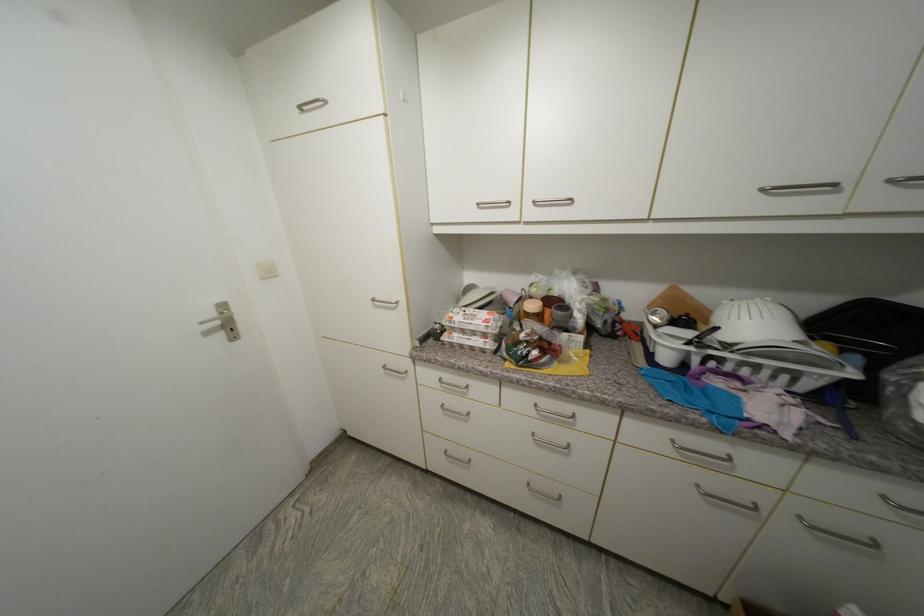
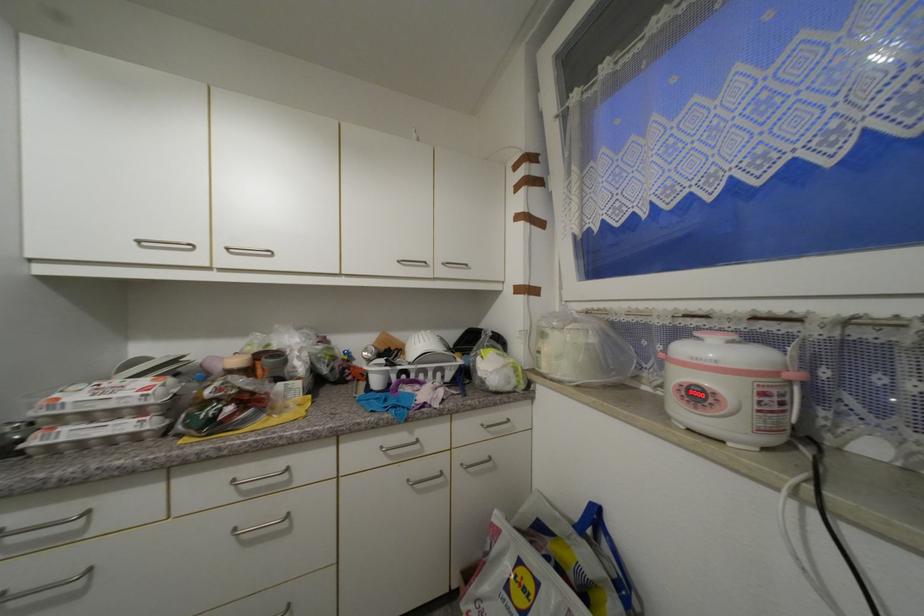
Locate, in the second image, the point that corresponds to [806,519] in the first image.

(468, 467)